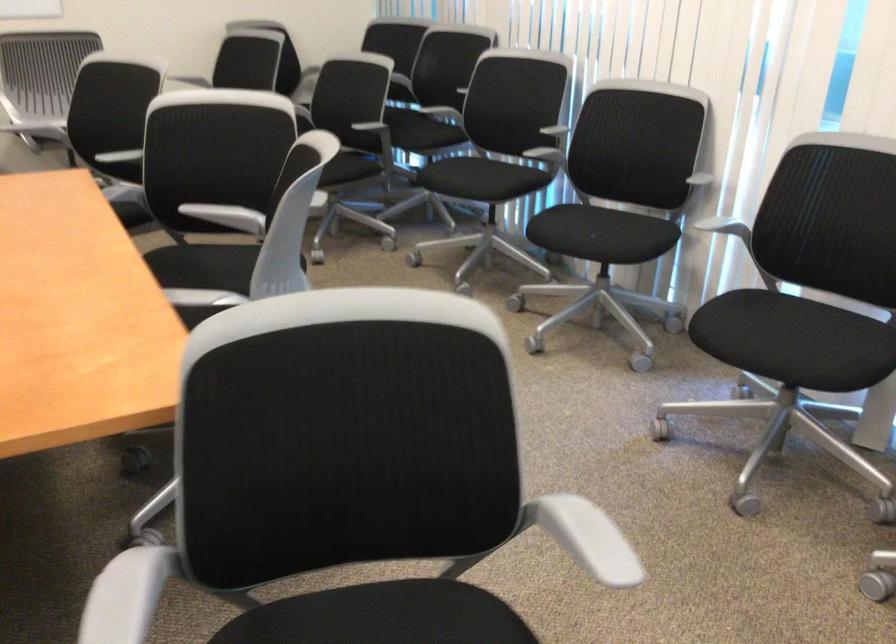
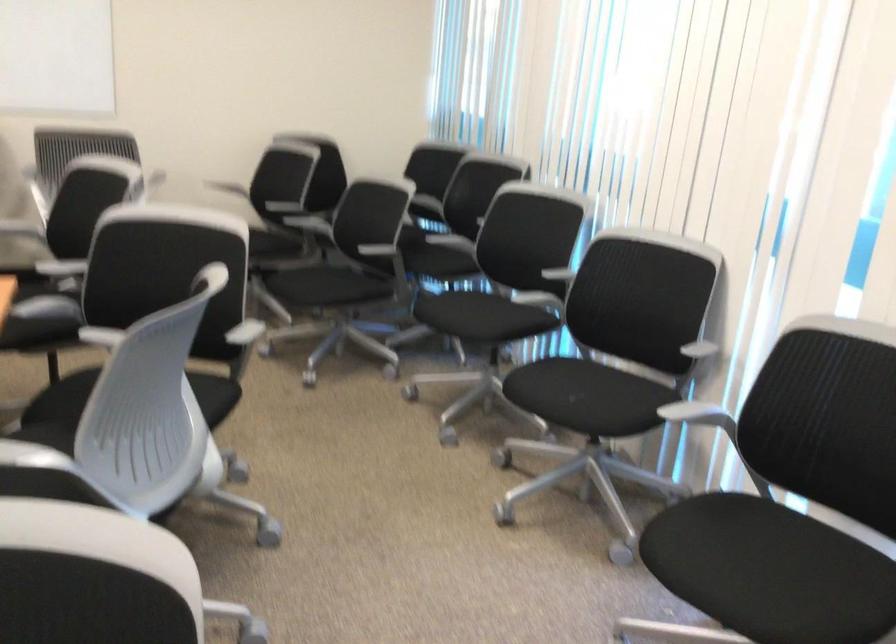
What movement of the cameraman would produce the second image?

The movement direction of the cameraman is right, forward.